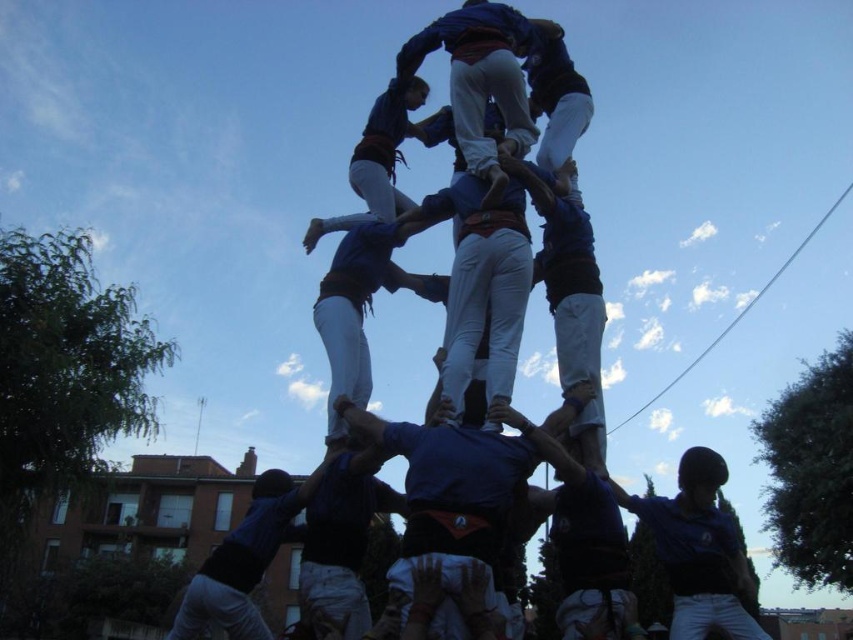
Question: Does blue fabric human at center appear under blue fabric man at center?

Choices:
 (A) no
 (B) yes

Answer: (A)

Question: Is blue fabric human at center to the left of blue fabric man at center from the viewer's perspective?

Choices:
 (A) yes
 (B) no

Answer: (B)

Question: Which point is closer to the camera taking this photo?

Choices:
 (A) (490, 76)
 (B) (679, 490)
 (C) (257, 493)

Answer: (C)

Question: Which point is farther to the camera?

Choices:
 (A) blue fabric man at center
 (B) blue fabric human at center

Answer: (A)

Question: Does blue fabric human at center have a greater width compared to blue fabric man at center?

Choices:
 (A) no
 (B) yes

Answer: (A)

Question: Which point appears farthest from the camera in this image?

Choices:
 (A) pyautogui.click(x=733, y=636)
 (B) pyautogui.click(x=695, y=554)

Answer: (B)